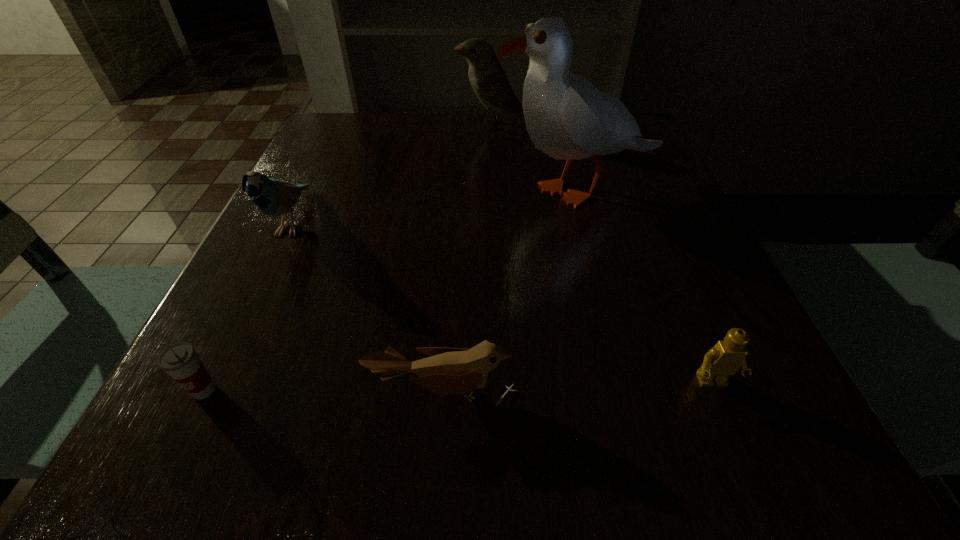
Where is `the tallest object`? the tallest object is located at coordinates (568, 118).

I want to click on the fifth shortest object, so click(489, 81).

Locate an element on the screen. This screenshot has width=960, height=540. the farthest bird is located at coordinates (489, 81).

Find the location of a particular element. the leftmost bird is located at coordinates (x=273, y=197).

Locate an element on the screen. This screenshot has height=540, width=960. the second farthest bird is located at coordinates (273, 197).

This screenshot has width=960, height=540. I want to click on cup, so click(180, 360).

You are a GUI agent. You are given a task and a screenshot of the screen. Output one action in this format:
    pyautogui.click(x=<x>, y=<y>)
    Task: Click on the Lego
    The height and width of the screenshot is (540, 960).
    Given the screenshot: What is the action you would take?
    pyautogui.click(x=729, y=356)

The image size is (960, 540). I want to click on the shortest bird, so click(x=449, y=371).

Identify the location of blank space located 0.200m at the beak of the gull. The width and height of the screenshot is (960, 540). (394, 191).

Where is `vacant space located 0.230m at the beak of the gull`? The width and height of the screenshot is (960, 540). vacant space located 0.230m at the beak of the gull is located at coordinates [x=379, y=191].